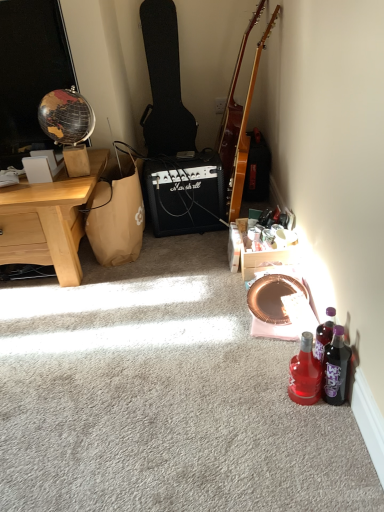
Looking at this image, what is the approximate height of wooden crate at lower right?

wooden crate at lower right is 6.06 inches tall.

This screenshot has width=384, height=512. What do you see at coordinates (48, 221) in the screenshot? I see `light brown wood desk at left` at bounding box center [48, 221].

The height and width of the screenshot is (512, 384). I want to click on translucent purple bottle at lower right, the second bottle positioned from the left, so click(x=336, y=368).

The image size is (384, 512). What do you see at coordinates (164, 83) in the screenshot?
I see `black textured guitar case at center-left, which is counted as the 2th guitar, starting from the right` at bounding box center [164, 83].

What do you see at coordinates (185, 194) in the screenshot? I see `black plastic marshall amplifier at center` at bounding box center [185, 194].

Locate an element on the screen. This screenshot has height=512, width=384. wooden crate at lower right is located at coordinates (259, 250).

Is glossy wood guitar at upper right, the first guitar in the right-to-left sequence, at the back of brown paper bag at left?

That's not correct — brown paper bag at left is not looking away from glossy wood guitar at upper right, the first guitar in the right-to-left sequence.

Considering the sizes of objects brown paper bag at left and glossy wood guitar at upper right, the first guitar in the right-to-left sequence, in the image provided, who is wider, brown paper bag at left or glossy wood guitar at upper right, the first guitar in the right-to-left sequence,?

brown paper bag at left is wider.

From the image's perspective, is brown paper bag at left above glossy wood guitar at upper right, the first guitar in the right-to-left sequence?

No, from the image's perspective, brown paper bag at left is not over glossy wood guitar at upper right, the first guitar in the right-to-left sequence.

Which object is further away from the camera taking this photo, glossy wood guitar at upper right, which appears as the second guitar when viewed from the left, or black textured guitar case at center-left, arranged as the 1th guitar when viewed from the left?

black textured guitar case at center-left, arranged as the 1th guitar when viewed from the left, is more distant.

Where is `guitar located above the glossy wood guitar at upper right, the first guitar in the right-to-left sequence (from the image's perspective)`? guitar located above the glossy wood guitar at upper right, the first guitar in the right-to-left sequence (from the image's perspective) is located at coordinates (164, 83).

Can you tell me how much glossy wood guitar at upper right, which appears as the second guitar when viewed from the left, and black textured guitar case at center-left, arranged as the 1th guitar when viewed from the left, differ in facing direction?

93.6 degrees.

Is glossy wood guitar at upper right, which appears as the second guitar when viewed from the left, wider or thinner than black textured guitar case at center-left, arranged as the 1th guitar when viewed from the left?

Clearly, glossy wood guitar at upper right, which appears as the second guitar when viewed from the left, has less width compared to black textured guitar case at center-left, arranged as the 1th guitar when viewed from the left.

Is glossy wood guitar at upper right, the first guitar in the right-to-left sequence, located within wooden crate at lower right?

No, glossy wood guitar at upper right, the first guitar in the right-to-left sequence, is not surrounded by wooden crate at lower right.

Is wooden crate at lower right in contact with glossy wood guitar at upper right, which appears as the second guitar when viewed from the left?

No, wooden crate at lower right is not making contact with glossy wood guitar at upper right, which appears as the second guitar when viewed from the left.

In the scene shown: How distant is wooden crate at lower right from glossy wood guitar at upper right, which appears as the second guitar when viewed from the left?

18.10 inches.

Considering the relative sizes of wooden crate at lower right and glossy wood guitar at upper right, the first guitar in the right-to-left sequence, in the image provided, is wooden crate at lower right bigger than glossy wood guitar at upper right, the first guitar in the right-to-left sequence,?

Actually, wooden crate at lower right might be smaller than glossy wood guitar at upper right, the first guitar in the right-to-left sequence.

You are a GUI agent. You are given a task and a screenshot of the screen. Output one action in this format:
    pyautogui.click(x=<x>, y=<y>)
    Task: Click on the 1st bottle directly beneath the brown paper bag at left (from a real-world perspective)
    This screenshot has height=512, width=384.
    Given the screenshot: What is the action you would take?
    pyautogui.click(x=336, y=368)

Does translucent purple bottle at lower right, the first bottle in the right-to-left sequence, lie in front of brown paper bag at left?

Yes, it is in front of brown paper bag at left.

Is translucent purple bottle at lower right, the second bottle positioned from the left, aimed at brown paper bag at left?

No, translucent purple bottle at lower right, the second bottle positioned from the left, is not aimed at brown paper bag at left.

Do you think light brown wood desk at left is within wooden crate at lower right, or outside of it?

light brown wood desk at left exists outside the volume of wooden crate at lower right.

Between light brown wood desk at left and wooden crate at lower right, which one has smaller width?

wooden crate at lower right.

Are light brown wood desk at left and wooden crate at lower right making contact?

No, light brown wood desk at left is not touching wooden crate at lower right.

Consider the image. From a real-world perspective, who is located lower, light brown wood desk at left or wooden crate at lower right?

In real-world perspective, wooden crate at lower right is lower.

Image resolution: width=384 pixels, height=512 pixels. Find the location of `handbag directly beneath the black textured guitar case at center-left, which is counted as the 2th guitar, starting from the right (from a real-world perspective)`. handbag directly beneath the black textured guitar case at center-left, which is counted as the 2th guitar, starting from the right (from a real-world perspective) is located at coordinates (116, 214).

Is black textured guitar case at center-left, which is counted as the 2th guitar, starting from the right, further to the viewer compared to brown paper bag at left?

Yes, black textured guitar case at center-left, which is counted as the 2th guitar, starting from the right, is further from the viewer.

Can brown paper bag at left be found inside black textured guitar case at center-left, which is counted as the 2th guitar, starting from the right?

No, brown paper bag at left is located outside of black textured guitar case at center-left, which is counted as the 2th guitar, starting from the right.

Are black textured guitar case at center-left, which is counted as the 2th guitar, starting from the right, and brown paper bag at left located far from each other?

That's not correct — black textured guitar case at center-left, which is counted as the 2th guitar, starting from the right, is a little close to brown paper bag at left.

Between glossy wood guitar at upper right, which appears as the second guitar when viewed from the left, and light brown wood desk at left, which one has smaller size?

With smaller size is glossy wood guitar at upper right, which appears as the second guitar when viewed from the left.

From the image's perspective, would you say glossy wood guitar at upper right, the first guitar in the right-to-left sequence, is shown under light brown wood desk at left?

No.

Based on the photo, between glossy wood guitar at upper right, which appears as the second guitar when viewed from the left, and light brown wood desk at left, which one has larger width?

With larger width is light brown wood desk at left.

I want to click on handbag to the left of glossy wood guitar at upper right, the first guitar in the right-to-left sequence, so click(x=116, y=214).

This screenshot has width=384, height=512. I want to click on guitar located above the glossy wood guitar at upper right, the first guitar in the right-to-left sequence (from a real-world perspective), so click(164, 83).

Which object lies nearer to the anchor point light brown wood desk at left, brown paper bag at left or translucent purple bottle at lower right, the second bottle positioned from the left?

The object closer to light brown wood desk at left is brown paper bag at left.

Which object lies further to the anchor point wooden crate at lower right, translucent purple bottle at lower right, the first bottle in the right-to-left sequence, or light brown wood desk at left?

The object further to wooden crate at lower right is light brown wood desk at left.

Looking at the image, which one is located further to black plastic marshall amplifier at center, glossy wood guitar at upper right, which appears as the second guitar when viewed from the left, or brown paper bag at left?

glossy wood guitar at upper right, which appears as the second guitar when viewed from the left, is positioned further to the anchor black plastic marshall amplifier at center.

Based on their spatial positions, is brown paper bag at left or translucent red glass bottle at lower right, acting as the 2th bottle starting from the right, closer to translucent purple bottle at lower right, the second bottle positioned from the left?

translucent red glass bottle at lower right, acting as the 2th bottle starting from the right, is positioned closer to the anchor translucent purple bottle at lower right, the second bottle positioned from the left.

From the image, which object appears to be farther from translucent purple bottle at lower right, the first bottle in the right-to-left sequence, light brown wood desk at left or wooden crate at lower right?

light brown wood desk at left lies further to translucent purple bottle at lower right, the first bottle in the right-to-left sequence, than the other object.

Considering their positions, is brown paper bag at left positioned closer to black textured guitar case at center-left, which is counted as the 2th guitar, starting from the right, than wooden crate at lower right?

brown paper bag at left is positioned closer to the anchor black textured guitar case at center-left, which is counted as the 2th guitar, starting from the right.

Based on their spatial positions, is translucent red glass bottle at lower right, positioned as the 1th bottle in left-to-right order, or black plastic marshall amplifier at center closer to glossy wood guitar at upper right, which appears as the second guitar when viewed from the left?

Based on the image, black plastic marshall amplifier at center appears to be nearer to glossy wood guitar at upper right, which appears as the second guitar when viewed from the left.

Considering their positions, is glossy wood guitar at upper right, which appears as the second guitar when viewed from the left, positioned closer to black plastic marshall amplifier at center than light brown wood desk at left?

glossy wood guitar at upper right, which appears as the second guitar when viewed from the left, is closer to black plastic marshall amplifier at center.

Find the location of a particular element. The width and height of the screenshot is (384, 512). loudspeaker between glossy wood guitar at upper right, the first guitar in the right-to-left sequence, and translucent red glass bottle at lower right, positioned as the 1th bottle in left-to-right order, vertically is located at coordinates (185, 194).

This screenshot has height=512, width=384. I want to click on loudspeaker between black textured guitar case at center-left, which is counted as the 2th guitar, starting from the right, and translucent purple bottle at lower right, the second bottle positioned from the left, vertically, so click(185, 194).

You are a GUI agent. You are given a task and a screenshot of the screen. Output one action in this format:
    pyautogui.click(x=<x>, y=<y>)
    Task: Click on the loudspeaker between glossy wood guitar at upper right, which appears as the second guitar when viewed from the left, and wooden crate at lower right vertically
    This screenshot has height=512, width=384.
    Given the screenshot: What is the action you would take?
    pyautogui.click(x=185, y=194)

Where is `box located between light brown wood desk at left and translucent purple bottle at lower right, the second bottle positioned from the left, in the left-right direction`? The width and height of the screenshot is (384, 512). box located between light brown wood desk at left and translucent purple bottle at lower right, the second bottle positioned from the left, in the left-right direction is located at coordinates (259, 250).